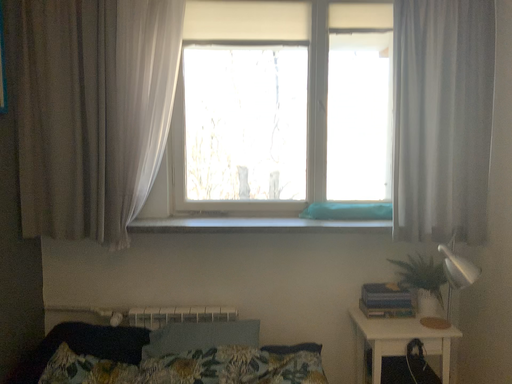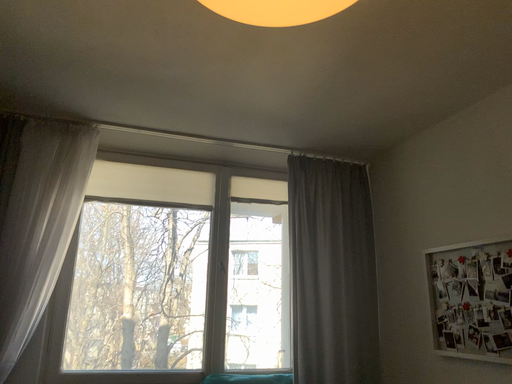
Question: How did the camera likely rotate when shooting the video?

Choices:
 (A) rotated upward
 (B) rotated downward

Answer: (A)